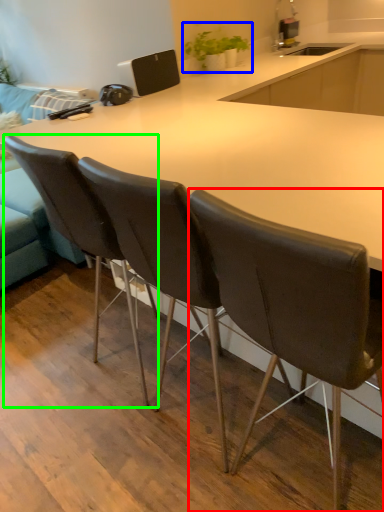
Question: Considering the real-world distances, which object is farthest from chair (highlighted by a red box)? houseplant (highlighted by a blue box) or chair (highlighted by a green box)?

Choices:
 (A) houseplant
 (B) chair

Answer: (A)